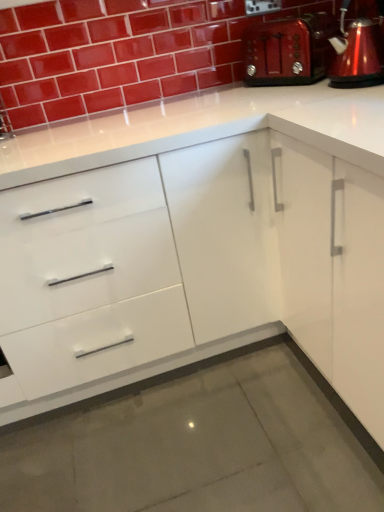
Identify the location of free point in front of metallic red toaster at upper right. This screenshot has height=512, width=384. click(x=277, y=98).